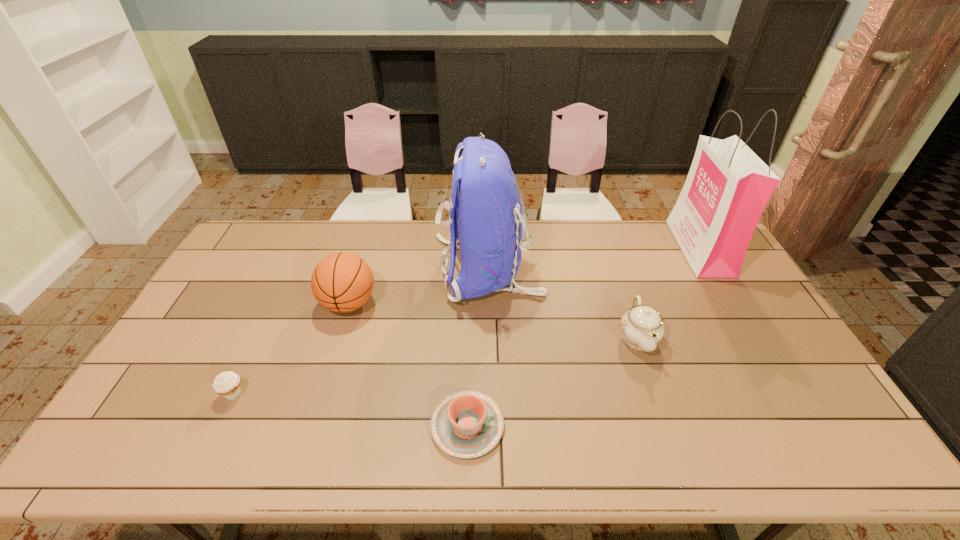
Identify the location of shopping bag located in the far edge section of the desktop. This screenshot has width=960, height=540. (728, 186).

You are a GUI agent. You are given a task and a screenshot of the screen. Output one action in this format:
    pyautogui.click(x=<x>, y=<y>)
    Task: Click on the backpack positioned at the far edge
    
    Given the screenshot: What is the action you would take?
    pyautogui.click(x=486, y=216)

Locate an element on the screen. object that is at the near edge is located at coordinates (467, 424).

You are a GUI agent. You are given a task and a screenshot of the screen. Output one action in this format:
    pyautogui.click(x=<x>, y=<y>)
    Task: Click on the object that is positioned at the right edge
    The height and width of the screenshot is (540, 960).
    Given the screenshot: What is the action you would take?
    coord(728,186)

This screenshot has width=960, height=540. Find the location of `object that is at the far right corner`. object that is at the far right corner is located at coordinates (728, 186).

This screenshot has height=540, width=960. In the image, there is a desktop. Identify the location of free space at the far edge. 531,250.

Identify the location of vacant space at the near edge. The height and width of the screenshot is (540, 960). (254, 457).

You are a GUI agent. You are given a task and a screenshot of the screen. Output one action in this format:
    pyautogui.click(x=<x>, y=<y>)
    Task: Click on the vacant space at the left edge of the desktop
    
    Given the screenshot: What is the action you would take?
    pyautogui.click(x=178, y=359)

Where is `vacant space at the right edge of the desktop`? The image size is (960, 540). vacant space at the right edge of the desktop is located at coordinates (711, 298).

Find the location of a particular element. vacant point located between the backpack and the rightmost object is located at coordinates (593, 258).